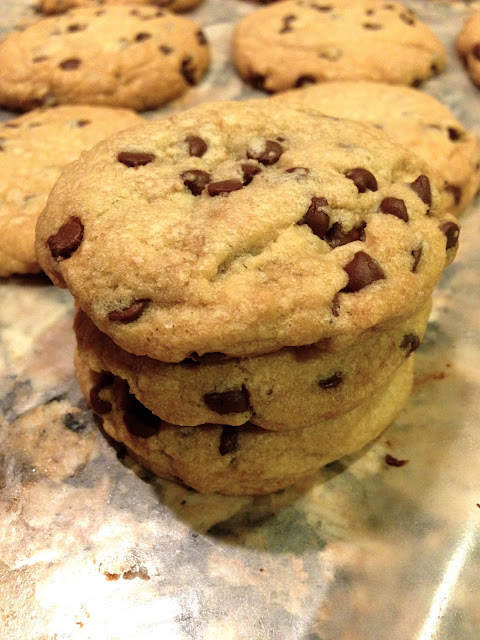
This screenshot has width=480, height=640. In order to click on white flowers on counter in this screenshot , I will do `click(326, 516)`, `click(357, 463)`, `click(290, 571)`, `click(110, 529)`, `click(42, 504)`, `click(49, 442)`, `click(66, 593)`.